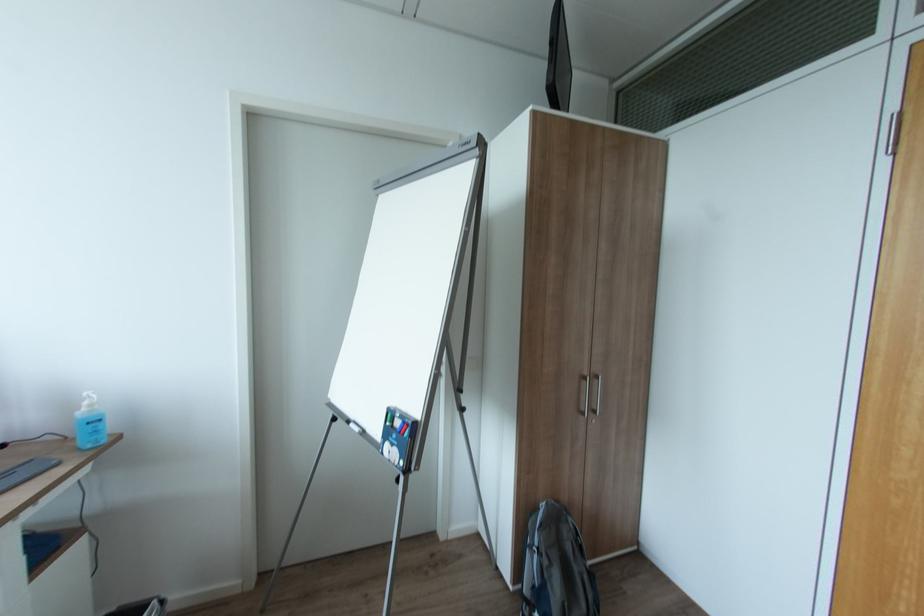
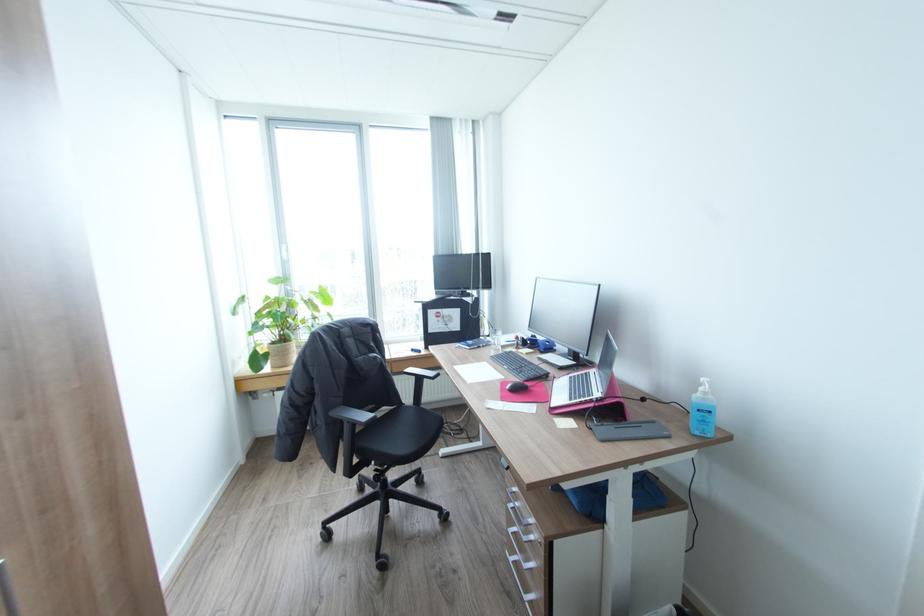
In the second image, find the point that corresponds to point 94,407 in the first image.

(710, 392)